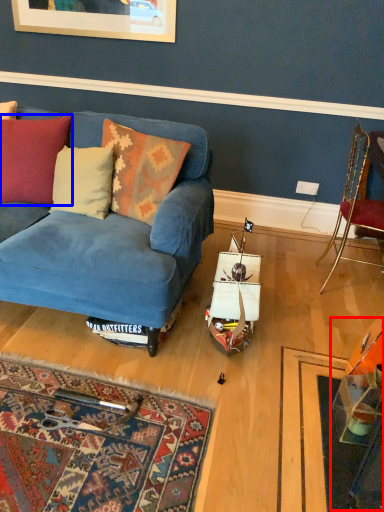
Question: Which object is closer to the camera taking this photo, table (highlighted by a red box) or cushion (highlighted by a blue box)?

Choices:
 (A) table
 (B) cushion

Answer: (A)